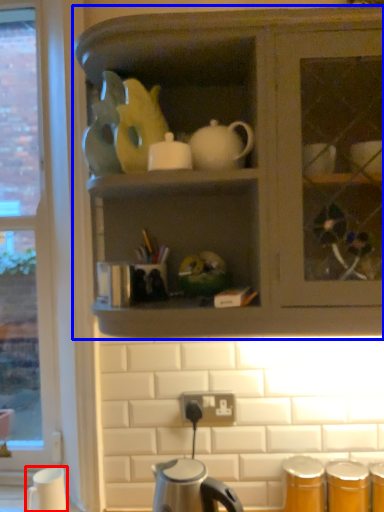
Question: Among these objects, which one is nearest to the camera, coffee cup (highlighted by a red box) or cabinetry (highlighted by a blue box)?

Choices:
 (A) coffee cup
 (B) cabinetry

Answer: (B)